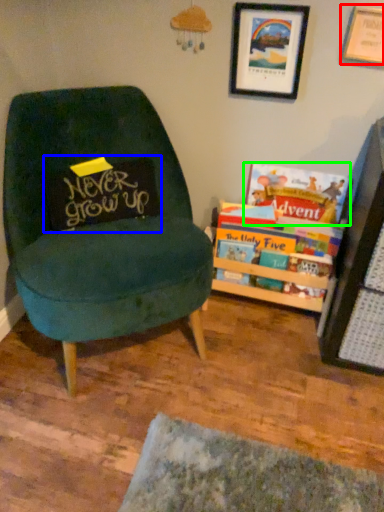
Question: Considering the real-world distances, which object is farthest from picture frame (highlighted by a red box)? pillow (highlighted by a blue box) or book (highlighted by a green box)?

Choices:
 (A) pillow
 (B) book

Answer: (A)